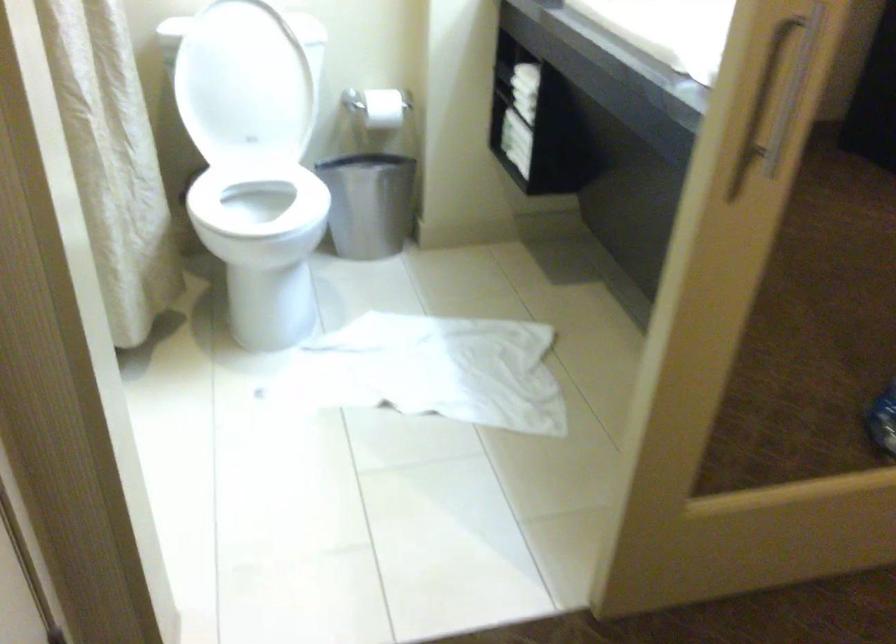
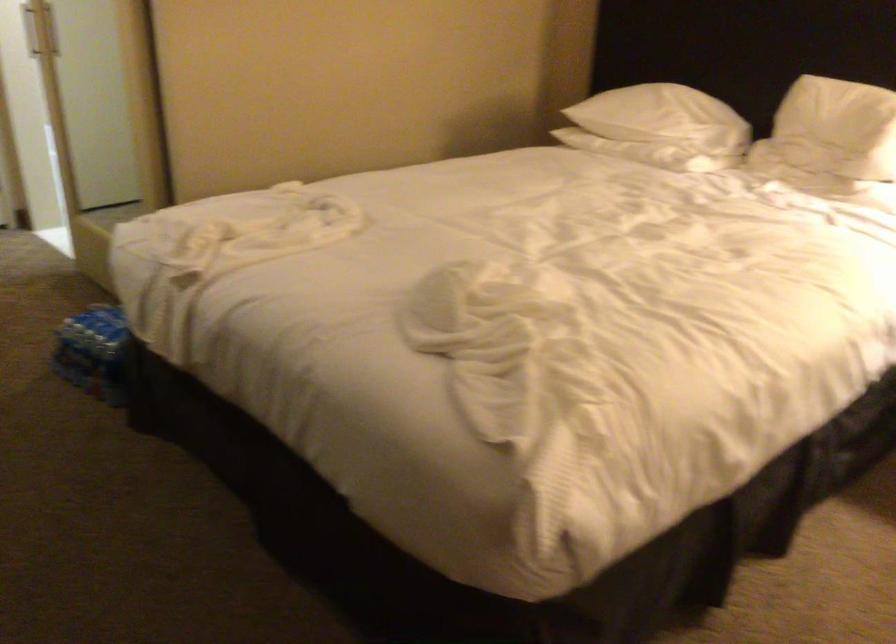
Question: I am providing you with two images of the same scene from different viewpoints. Please identify which objects are invisible in image2.

Choices:
 (A) rolled white towel
 (B) door handle
 (C) white pillow
 (D) small black tripod

Answer: (A)